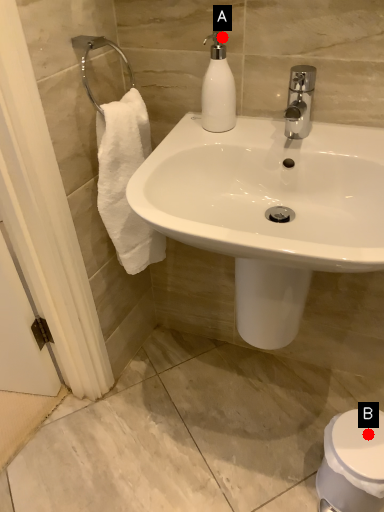
Question: Two points are circled on the image, labeled by A and B beside each circle. Which point is closer to the camera taking this photo?

Choices:
 (A) A is closer
 (B) B is closer

Answer: (A)